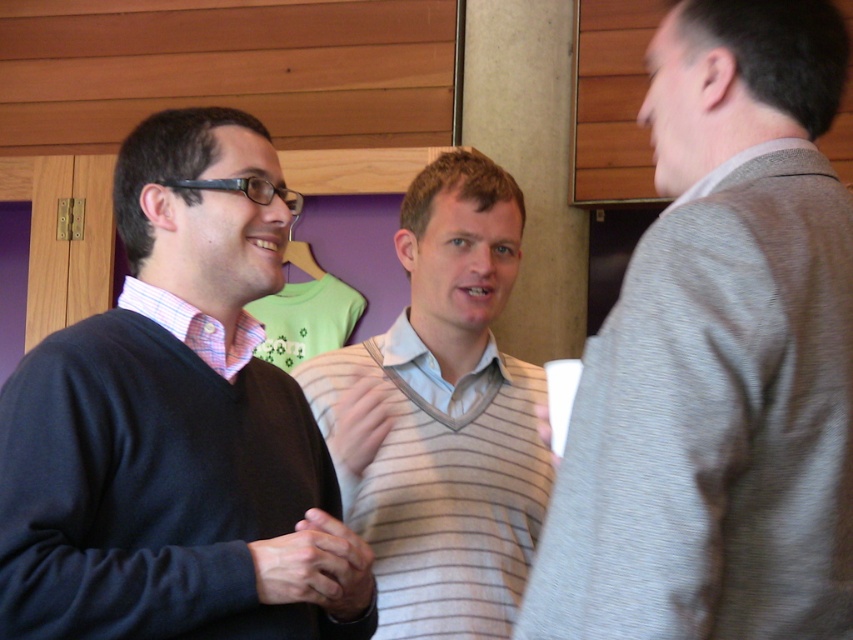
Based on the scene description, which object is taller, the striped sweater at center or the pink checkered shirt at left?

The striped sweater at center is much taller than the pink checkered shirt at left according to the description.